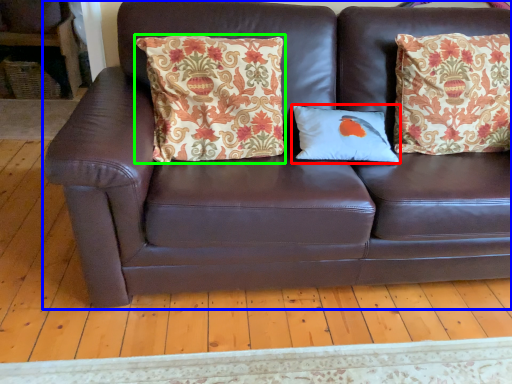
Question: Estimate the real-world distances between objects in this image. Which object is farther from pillow (highlighted by a red box), studio couch (highlighted by a blue box) or pillow (highlighted by a green box)?

Choices:
 (A) studio couch
 (B) pillow

Answer: (A)